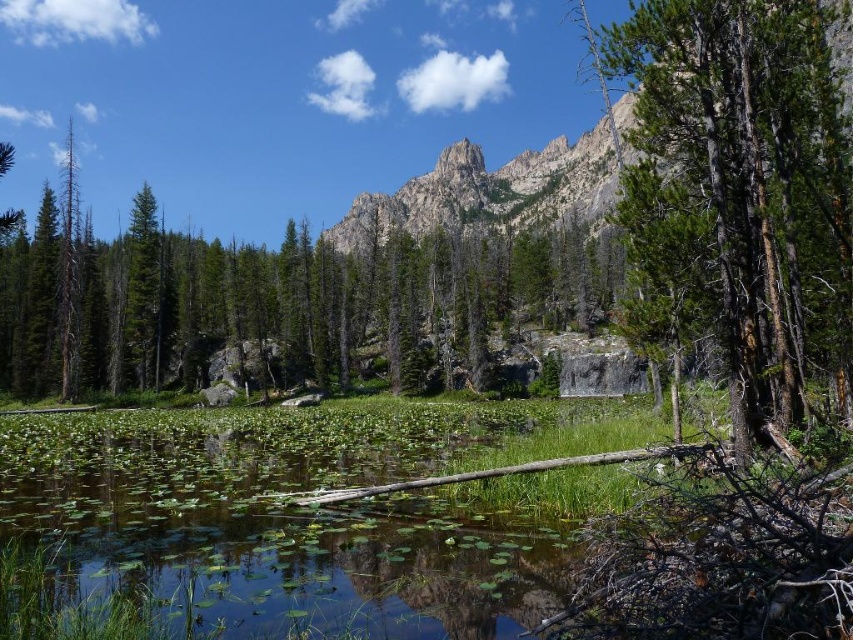
You are planning to place a small wooden bench in the scene. The bench requires a space larger than the green leafy water at lower left. Can the green rough bark tree at right provide enough space for the bench?

The green rough bark tree at right is bigger than the green leafy water at lower left, so yes, the space around the green rough bark tree at right is sufficient to accommodate the bench.

You are standing at the center of the image and want to locate the green rough bark tree at right. According to the coordinates provided, in which direction should you turn to face the tree?

The green rough bark tree at right is located at coordinates point (741,196). Since the x coordinate is 0.309, which is less than 0.5, the tree is to the left side of the image. Therefore, you should turn to your left to face the green rough bark tree at right.

You are standing at the center of the pond and want to reach the green rough bark tree at right. Which direction should you head towards?

You should head towards the right direction to reach the green rough bark tree at right since it is located at point 0.309 on the x axis which is to the right side of the image.